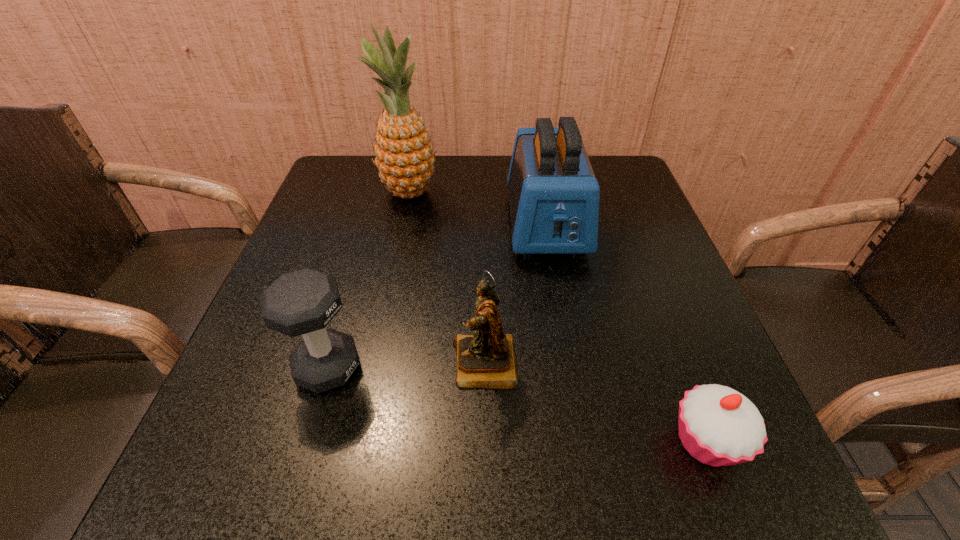
At what (x,y) coordinates should I click in order to perform the action: click on pineapple. Please return your answer as a coordinate pair (x, y). Looking at the image, I should click on (404, 152).

Locate an element on the screen. the second object from right to left is located at coordinates (554, 196).

Where is `toaster`? This screenshot has height=540, width=960. toaster is located at coordinates (554, 196).

You are a GUI agent. You are given a task and a screenshot of the screen. Output one action in this format:
    pyautogui.click(x=<x>, y=<y>)
    Task: Click on the figurine
    This screenshot has width=960, height=540.
    Given the screenshot: What is the action you would take?
    pyautogui.click(x=486, y=359)

Image resolution: width=960 pixels, height=540 pixels. What are the coordinates of `dumbbell` in the screenshot? It's located at (303, 302).

Find the location of a particular element. The width and height of the screenshot is (960, 540). the nearest object is located at coordinates (718, 426).

Find the location of a particular element. The image size is (960, 540). the shortest object is located at coordinates pyautogui.click(x=718, y=426).

The image size is (960, 540). In order to click on vacant space situated on the right of the tallest object in this screenshot , I will do `click(517, 192)`.

You are a GUI agent. You are given a task and a screenshot of the screen. Output one action in this format:
    pyautogui.click(x=<x>, y=<y>)
    Task: Click on the free space located 0.340m on the front-facing side of the toaster
    
    Given the screenshot: What is the action you would take?
    pyautogui.click(x=580, y=414)

The width and height of the screenshot is (960, 540). In order to click on free space located on the front-facing side of the third object from right to left in this screenshot , I will do `click(252, 364)`.